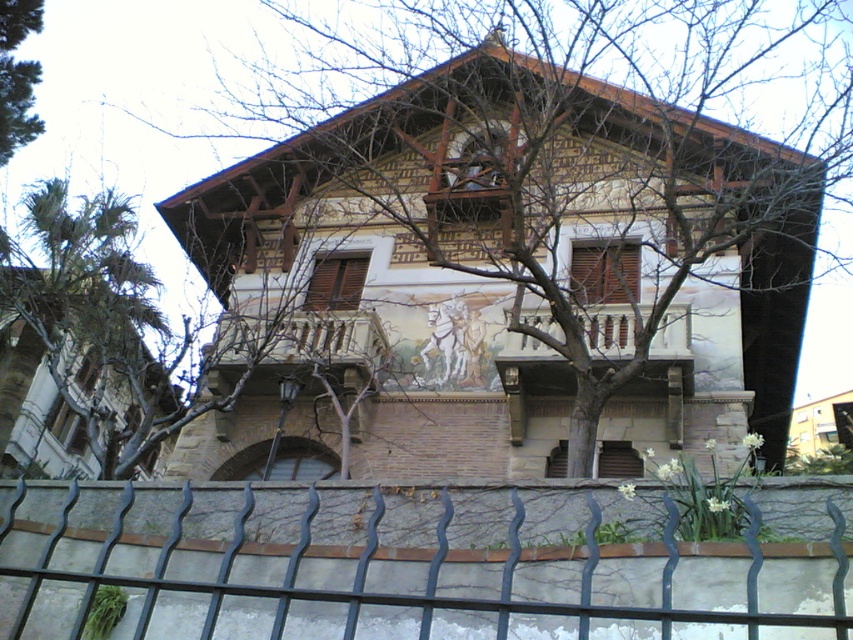
Is brown leafless tree at center to the left of wooden at center from the viewer's perspective?

Indeed, brown leafless tree at center is positioned on the left side of wooden at center.

Where is `brown leafless tree at center`? The width and height of the screenshot is (853, 640). brown leafless tree at center is located at coordinates (531, 52).

Consider the image. Who is more distant from viewer, (763, 346) or (593, 348)?

Positioned behind is point (763, 346).

The image size is (853, 640). Identify the location of brown leafless tree at center. (531, 52).

Can you confirm if black wrought iron fence at lower center is positioned above brown leafless tree at center?

Actually, black wrought iron fence at lower center is below brown leafless tree at center.

Is the position of black wrought iron fence at lower center more distant than that of brown leafless tree at center?

No, black wrought iron fence at lower center is closer to the viewer.

Which is in front, point (323, 602) or point (379, 22)?

Point (323, 602) is in front.

Locate an element on the screen. Image resolution: width=853 pixels, height=640 pixels. black wrought iron fence at lower center is located at coordinates (416, 563).

Who is more distant from viewer, (x=621, y=4) or (x=296, y=323)?

Point (x=621, y=4)

Is point (688, 268) farther from viewer compared to point (358, 339)?

No.

Where is `brown leafless tree at center`? The height and width of the screenshot is (640, 853). brown leafless tree at center is located at coordinates (531, 52).